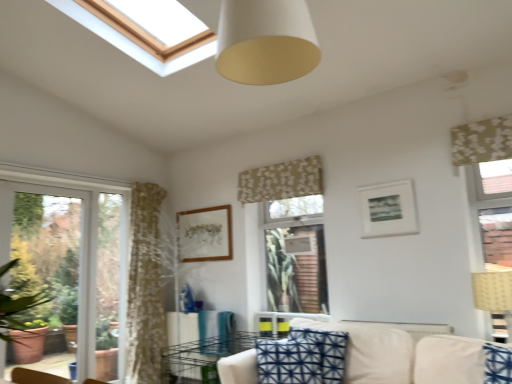
Question: Does white matte cone at upper center contain wooden picture frame at center, marked as the first picture frame in a back-to-front arrangement?

Choices:
 (A) yes
 (B) no

Answer: (B)

Question: Is white matte cone at upper center thinner than wooden picture frame at center, placed as the 2th picture frame when sorted from front to back?

Choices:
 (A) yes
 (B) no

Answer: (B)

Question: Is white matte cone at upper center outside wooden picture frame at center, marked as the first picture frame in a back-to-front arrangement?

Choices:
 (A) no
 (B) yes

Answer: (B)

Question: From a real-world perspective, is white matte cone at upper center on top of wooden picture frame at center, placed as the 2th picture frame when sorted from front to back?

Choices:
 (A) no
 (B) yes

Answer: (B)

Question: Considering the relative sizes of white matte cone at upper center and wooden picture frame at center, placed as the 2th picture frame when sorted from front to back, in the image provided, is white matte cone at upper center smaller than wooden picture frame at center, placed as the 2th picture frame when sorted from front to back,?

Choices:
 (A) no
 (B) yes

Answer: (A)

Question: Is white matte cone at upper center facing away from wooden picture frame at center, the first picture frame positioned from the left?

Choices:
 (A) no
 (B) yes

Answer: (A)

Question: Considering the relative positions of beige woven lampshade at right and floral fabric curtain at center, positioned as the second curtain in right-to-left order, in the image provided, is beige woven lampshade at right to the right of floral fabric curtain at center, positioned as the second curtain in right-to-left order, from the viewer's perspective?

Choices:
 (A) no
 (B) yes

Answer: (B)

Question: Does beige woven lampshade at right lie behind floral fabric curtain at center, which is the first curtain from left to right?

Choices:
 (A) yes
 (B) no

Answer: (B)

Question: From the image's perspective, is beige woven lampshade at right on top of floral fabric curtain at center, the 2th curtain when ordered from front to back?

Choices:
 (A) no
 (B) yes

Answer: (A)

Question: Would you consider beige woven lampshade at right to be distant from floral fabric curtain at center, which is the first curtain from left to right?

Choices:
 (A) no
 (B) yes

Answer: (B)

Question: Can you confirm if beige woven lampshade at right is thinner than floral fabric curtain at center, which is the first curtain from left to right?

Choices:
 (A) no
 (B) yes

Answer: (A)

Question: From a real-world perspective, is beige woven lampshade at right beneath floral fabric curtain at center, which is the first curtain from left to right?

Choices:
 (A) no
 (B) yes

Answer: (B)

Question: Is white glass window at left further to camera compared to white matte cone at upper center?

Choices:
 (A) no
 (B) yes

Answer: (B)